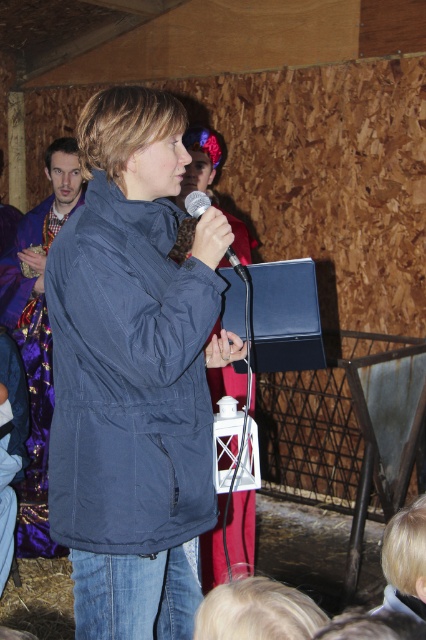
Can you confirm if navy blue jacket at center is bigger than black matte microphone at center?

Yes, navy blue jacket at center is bigger than black matte microphone at center.

Does navy blue jacket at center appear under black matte microphone at center?

Correct, navy blue jacket at center is located below black matte microphone at center.

Where is `navy blue jacket at center`? navy blue jacket at center is located at coordinates [x=134, y=374].

Which of these two, purple sequined robe at left or black matte microphone at center, stands taller?

purple sequined robe at left

The height and width of the screenshot is (640, 426). What do you see at coordinates (32, 374) in the screenshot?
I see `purple sequined robe at left` at bounding box center [32, 374].

Image resolution: width=426 pixels, height=640 pixels. What are the coordinates of `purple sequined robe at left` in the screenshot? It's located at (32, 374).

Is the position of navy blue jacket at center less distant than that of purple sequined robe at left?

Yes, it is.

Between navy blue jacket at center and purple sequined robe at left, which one appears on the left side from the viewer's perspective?

purple sequined robe at left

This screenshot has height=640, width=426. What do you see at coordinates (134, 374) in the screenshot?
I see `navy blue jacket at center` at bounding box center [134, 374].

The image size is (426, 640). Identify the location of navy blue jacket at center. (134, 374).